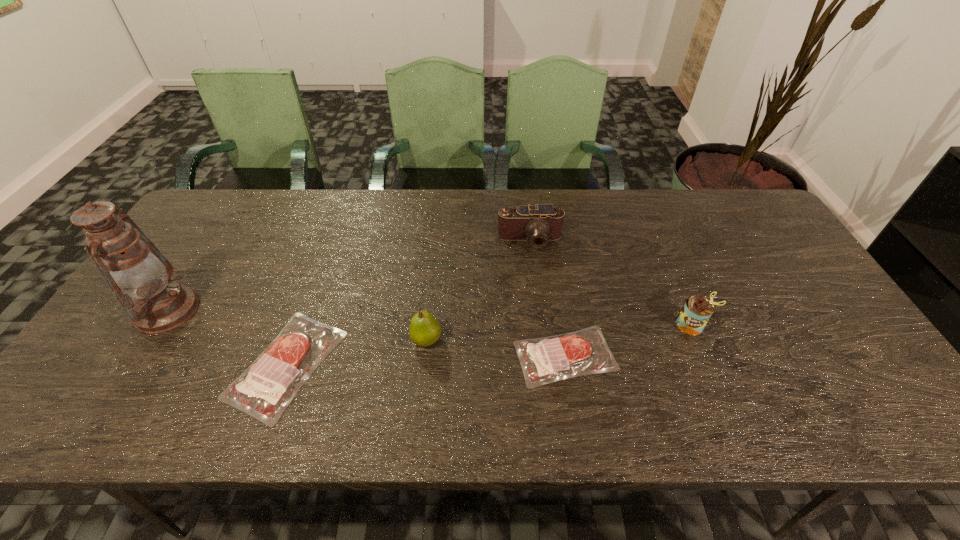
Identify the location of free space located 0.300m on the left of the shorter steak. This screenshot has height=540, width=960. (389, 356).

The image size is (960, 540). In order to click on vacant area situated 0.340m on the front-facing side of the camera in this screenshot , I will do `click(542, 348)`.

The width and height of the screenshot is (960, 540). I want to click on blank space located on the right of the pear, so click(498, 340).

Locate an element on the screen. free space located 0.210m on the back of the leftmost object is located at coordinates (215, 235).

Image resolution: width=960 pixels, height=540 pixels. I want to click on vacant space located on the back of the can, so tap(664, 263).

The width and height of the screenshot is (960, 540). What are the coordinates of `object that is at the far edge` in the screenshot? It's located at (540, 223).

Locate an element on the screen. Image resolution: width=960 pixels, height=540 pixels. object located at the left edge is located at coordinates (159, 304).

Where is `free spot at the far edge of the desktop`? free spot at the far edge of the desktop is located at coordinates (465, 196).

Locate an element on the screen. Image resolution: width=960 pixels, height=540 pixels. free space at the near edge of the desktop is located at coordinates (761, 388).

At what (x,y) coordinates should I click in order to perform the action: click on vacant region at the left edge of the desktop. Please return your answer as a coordinate pair (x, y). The image size is (960, 540). Looking at the image, I should click on (125, 321).